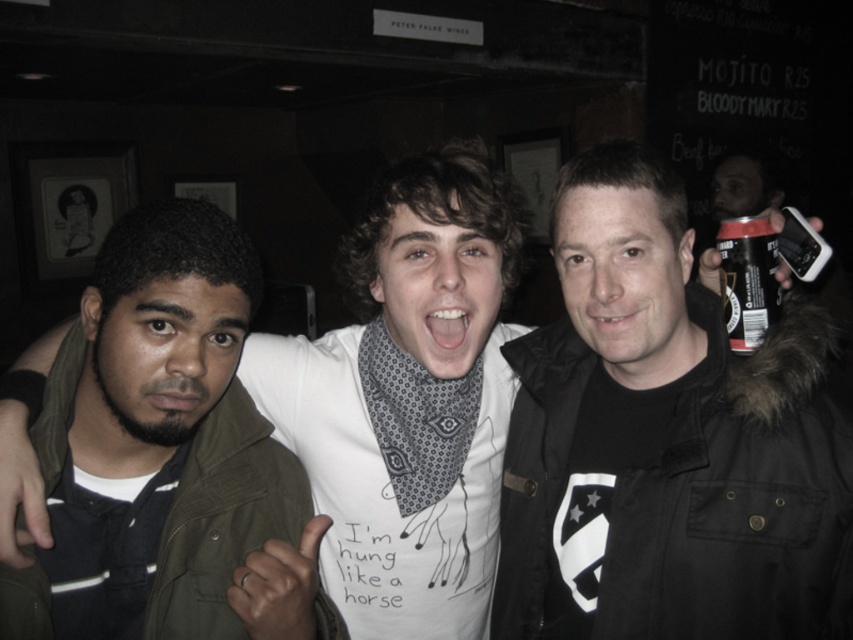
Question: Estimate the real-world distances between objects in this image. Which object is farther from the green matte jacket at left?

Choices:
 (A) black matte jacket at center
 (B) black matte can at upper right

Answer: (B)

Question: Which point is closer to the camera?

Choices:
 (A) (695, 605)
 (B) (741, 221)
 (C) (293, 461)

Answer: (A)

Question: Is black matte jacket at center thinner than green matte jacket at left?

Choices:
 (A) yes
 (B) no

Answer: (B)

Question: Is black matte jacket at center to the left of green matte jacket at left from the viewer's perspective?

Choices:
 (A) no
 (B) yes

Answer: (A)

Question: Which point is closer to the camera?

Choices:
 (A) (625, 148)
 (B) (165, 531)
 (C) (758, 292)

Answer: (B)

Question: In this image, where is black matte jacket at center located relative to green matte jacket at left?

Choices:
 (A) left
 (B) right

Answer: (B)